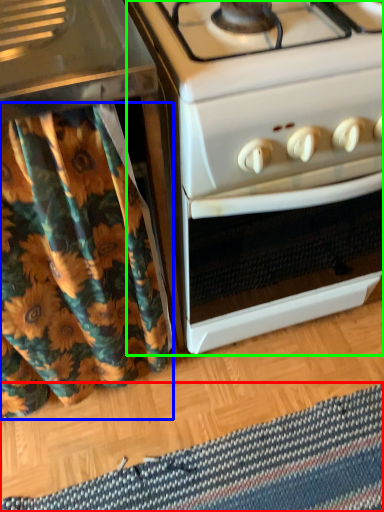
Question: Which is farther away from mat (highlighted by a red box)? shower curtain (highlighted by a blue box) or oven (highlighted by a green box)?

Choices:
 (A) shower curtain
 (B) oven

Answer: (B)